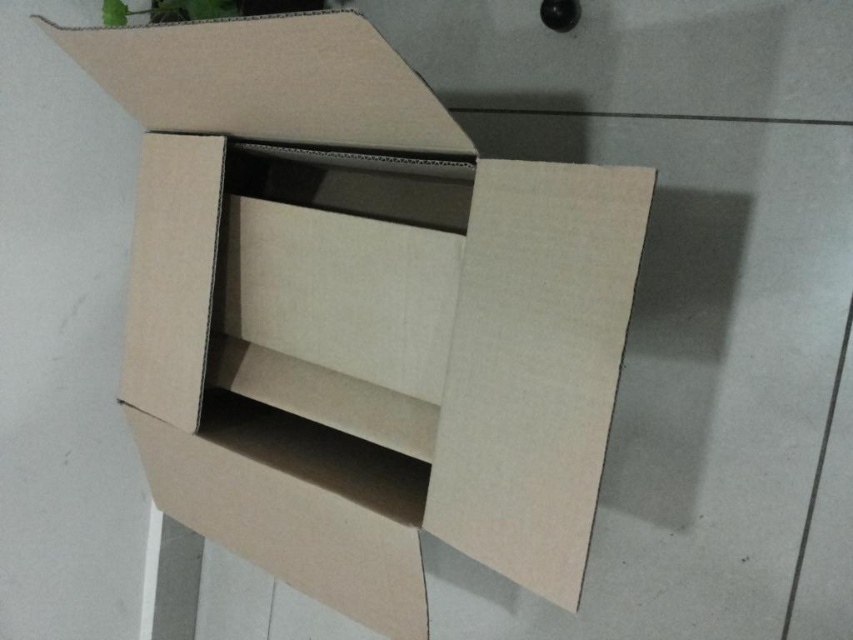
Question: In this image, where is brown cardboard box at center located relative to green leafy plant at upper left?

Choices:
 (A) left
 (B) right

Answer: (B)

Question: Is the position of brown cardboard box at center more distant than that of green leafy plant at upper left?

Choices:
 (A) yes
 (B) no

Answer: (B)

Question: Which point appears farthest from the camera in this image?

Choices:
 (A) (125, 4)
 (B) (556, 234)

Answer: (A)

Question: Does brown cardboard box at center have a greater width compared to green leafy plant at upper left?

Choices:
 (A) yes
 (B) no

Answer: (A)

Question: Which point is closer to the camera?

Choices:
 (A) brown cardboard box at center
 (B) green leafy plant at upper left

Answer: (A)